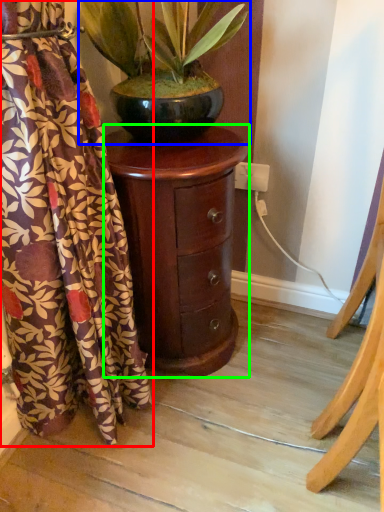
Question: Considering the real-world distances, which object is farthest from curtain (highlighted by a red box)? houseplant (highlighted by a blue box) or nightstand (highlighted by a green box)?

Choices:
 (A) houseplant
 (B) nightstand

Answer: (A)